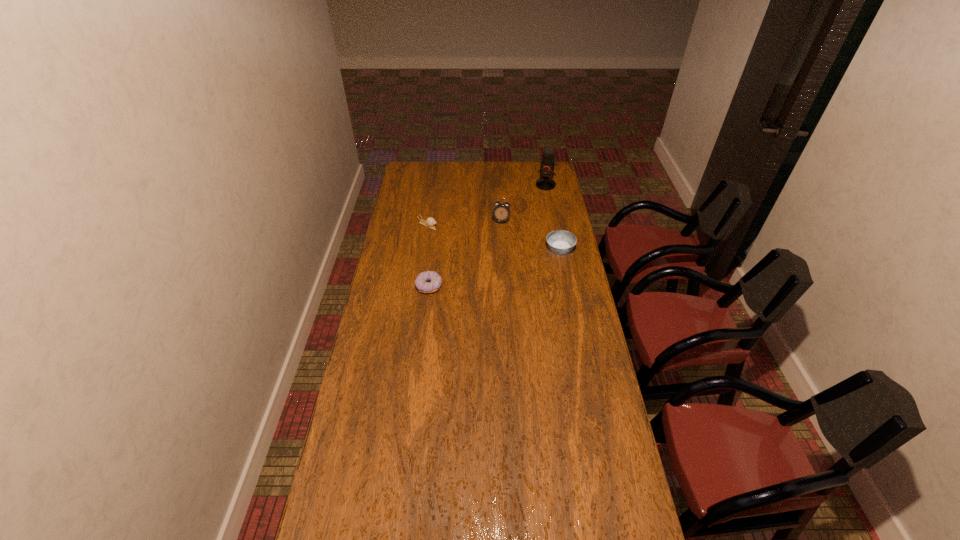
Identify the location of blank space at the near right corner of the desktop. (599, 502).

Identify the location of free space between the escargot and the tallest object. (487, 205).

At what (x,y) coordinates should I click in order to perform the action: click on vacant space in between the farthest object and the nearest object. Please return your answer as a coordinate pair (x, y). The height and width of the screenshot is (540, 960). Looking at the image, I should click on (488, 236).

Image resolution: width=960 pixels, height=540 pixels. What are the coordinates of `unoccupied position between the farthest object and the third object from left to right` in the screenshot? It's located at (523, 203).

The image size is (960, 540). What are the coordinates of `vacant region between the alarm clock and the nearest object` in the screenshot? It's located at (465, 254).

Image resolution: width=960 pixels, height=540 pixels. In order to click on free area in between the farthest object and the alarm clock in this screenshot , I will do `click(523, 203)`.

Identify the location of free point between the ashtray and the escargot. (493, 237).

Locate an element on the screen. The image size is (960, 540). empty space that is in between the tallest object and the nearest object is located at coordinates (488, 236).

What are the coordinates of `vacant point located between the nearest object and the escargot` in the screenshot? It's located at (428, 256).

Identify the location of free space between the tallest object and the second nearest object. The width and height of the screenshot is (960, 540). (553, 217).